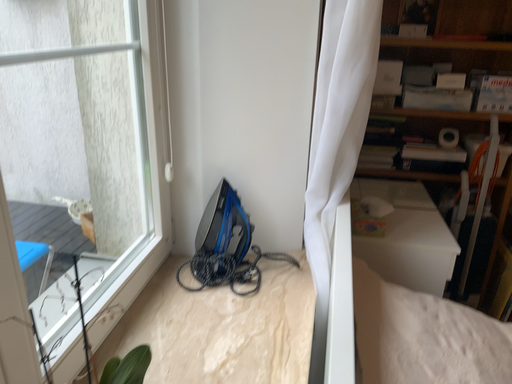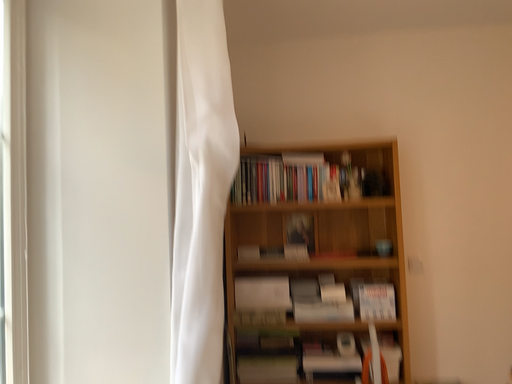
Question: Which way did the camera rotate in the video?

Choices:
 (A) rotated upward
 (B) rotated downward

Answer: (A)